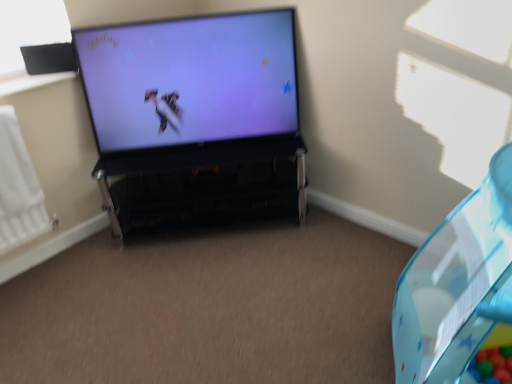
Where is `empty space that is ontop of black glossy tv stand at center`? The image size is (512, 384). empty space that is ontop of black glossy tv stand at center is located at coordinates (183, 151).